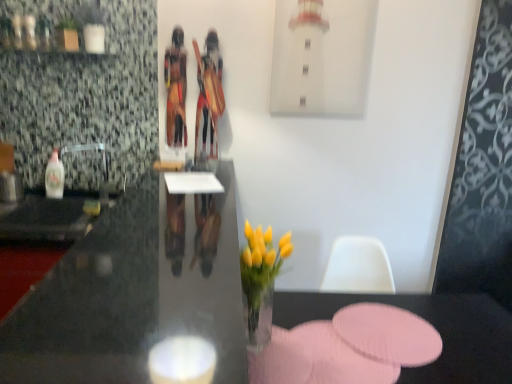
Question: Is wooden tribal figure at center, which appears as the first person when viewed from the right, outside translucent plastic bottle at left?

Choices:
 (A) yes
 (B) no

Answer: (A)

Question: Could you tell me if wooden tribal figure at center, which appears as the first person when viewed from the right, is facing translucent plastic bottle at left?

Choices:
 (A) no
 (B) yes

Answer: (A)

Question: Is wooden tribal figure at center, which appears as the first person when viewed from the right, thinner than translucent plastic bottle at left?

Choices:
 (A) no
 (B) yes

Answer: (A)

Question: From the image's perspective, is wooden tribal figure at center, the second person when ordered from left to right, below translucent plastic bottle at left?

Choices:
 (A) no
 (B) yes

Answer: (A)

Question: Is the depth of wooden tribal figure at center, which appears as the first person when viewed from the right, greater than that of translucent plastic bottle at left?

Choices:
 (A) no
 (B) yes

Answer: (A)

Question: Considering the positions of wooden tribal figure at center, the second person positioned from the right, and pink fabric placemat at lower center in the image, is wooden tribal figure at center, the second person positioned from the right, wider or thinner than pink fabric placemat at lower center?

Choices:
 (A) wide
 (B) thin

Answer: (B)

Question: From the image's perspective, relative to pink fabric placemat at lower center, is wooden tribal figure at center, the second person positioned from the right, above or below?

Choices:
 (A) below
 (B) above

Answer: (B)

Question: Considering the relative positions of wooden tribal figure at center, placed as the 1th person when sorted from left to right, and pink fabric placemat at lower center in the image provided, is wooden tribal figure at center, placed as the 1th person when sorted from left to right, to the left or to the right of pink fabric placemat at lower center?

Choices:
 (A) right
 (B) left

Answer: (B)

Question: From a real-world perspective, relative to pink fabric placemat at lower center, is wooden tribal figure at center, the second person positioned from the right, vertically above or below?

Choices:
 (A) above
 (B) below

Answer: (A)

Question: Considering the relative positions of wooden tribal figure at center, which appears as the first person when viewed from the right, and black glossy desk at center in the image provided, is wooden tribal figure at center, which appears as the first person when viewed from the right, to the left or to the right of black glossy desk at center?

Choices:
 (A) right
 (B) left

Answer: (A)

Question: Considering the positions of point (201, 162) and point (234, 246), is point (201, 162) closer or farther from the camera than point (234, 246)?

Choices:
 (A) closer
 (B) farther

Answer: (B)

Question: From a real-world perspective, is wooden tribal figure at center, the second person when ordered from left to right, positioned above or below black glossy desk at center?

Choices:
 (A) below
 (B) above

Answer: (B)

Question: From the image's perspective, relative to black glossy desk at center, is wooden tribal figure at center, which appears as the first person when viewed from the right, above or below?

Choices:
 (A) above
 (B) below

Answer: (A)

Question: Looking at the image, does black glossy desk at center seem bigger or smaller compared to wooden tribal figure at center, the second person when ordered from left to right?

Choices:
 (A) big
 (B) small

Answer: (A)

Question: From the image's perspective, is black glossy desk at center above or below wooden tribal figure at center, which appears as the first person when viewed from the right?

Choices:
 (A) below
 (B) above

Answer: (A)